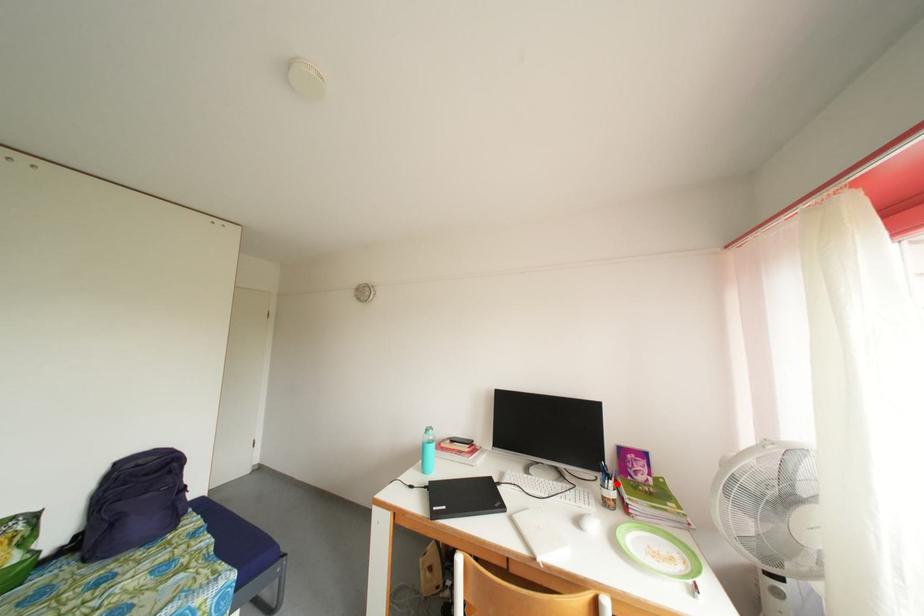
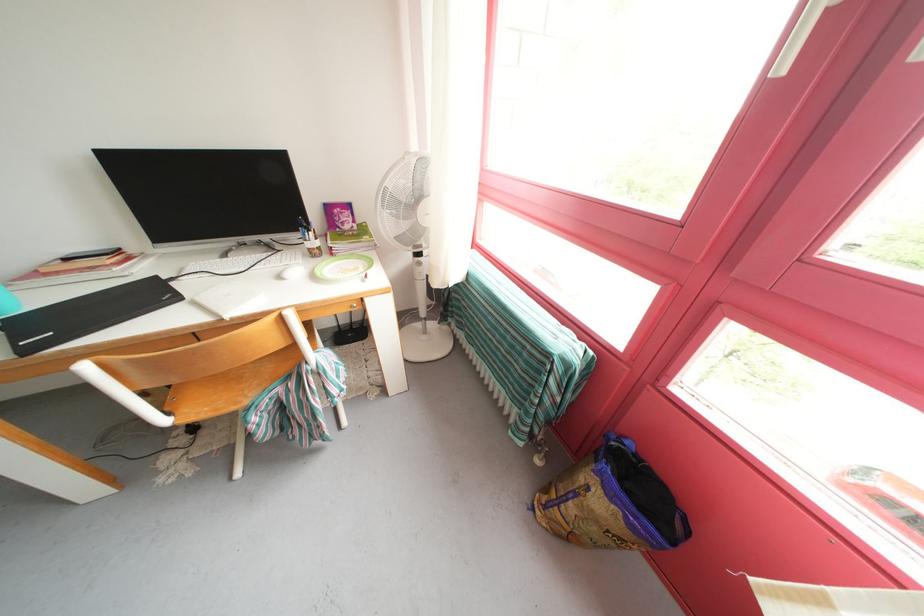
Question: A red point is marked in image1. In image2, is the corresponding 3D point closer to the camera or farther? Reply with the corresponding letter.

Choices:
 (A) The corresponding 3D point is closer.
 (B) The corresponding 3D point is farther.

Answer: (A)